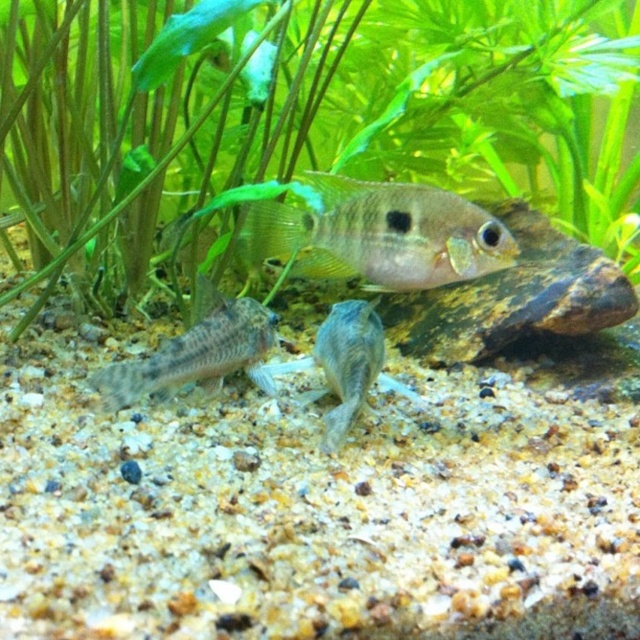
You are an underwater explorer who needs to navigate between the green leafy plant at upper center and the shiny silver fish at center. Which object is wider, requiring more space to maneuver around?

The green leafy plant at upper center is wider than the shiny silver fish at center, so you would need more space to maneuver around it.

You are an underwater explorer observing the aquarium scene. You notice the speckled gray gravel at lower left and the translucent gray fish at center. Which object is smaller in size?

The speckled gray gravel at lower left is smaller than the translucent gray fish at center according to the description.

You are an underwater photographer aiming to capture the speckled gray gravel at lower left and the translucent gray fish at center in a single shot. Based on their positions, which object will appear larger in your camera viewfinder?

The speckled gray gravel at lower left will appear larger in the camera viewfinder because it is closer to the viewer than the translucent gray fish at center.